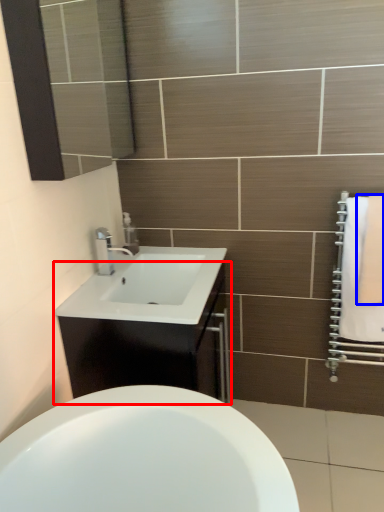
Question: Among these objects, which one is farthest to the camera, bathroom cabinet (highlighted by a red box) or bath towel (highlighted by a blue box)?

Choices:
 (A) bathroom cabinet
 (B) bath towel

Answer: (B)